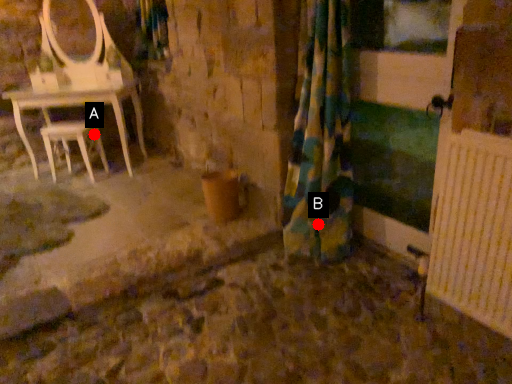
Question: Two points are circled on the image, labeled by A and B beside each circle. Which of the following is the closest to the observer?

Choices:
 (A) A is closer
 (B) B is closer

Answer: (B)